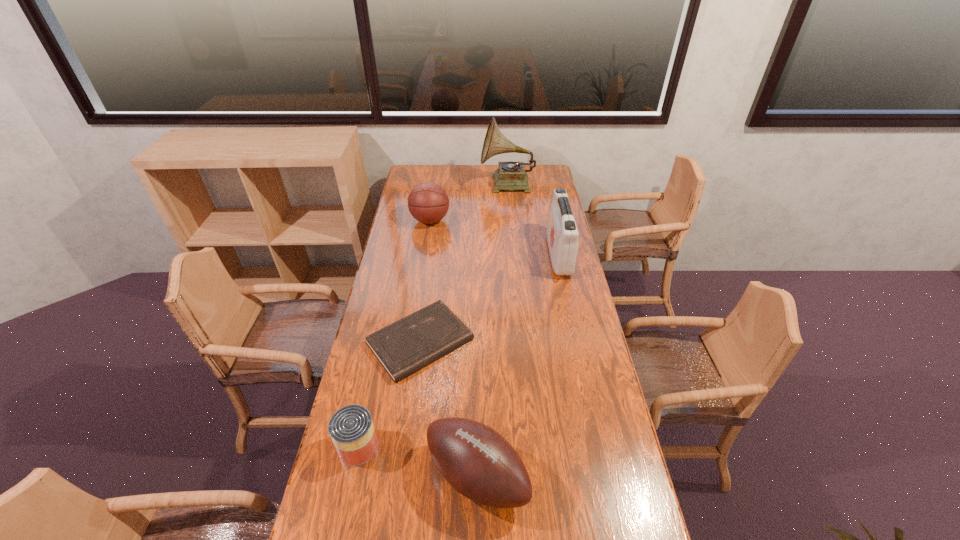
Identify the location of vacant region between the farthest object and the fifth nearest object. (468, 203).

The image size is (960, 540). What are the coordinates of `free spot between the can and the shortest object` in the screenshot? It's located at (389, 394).

I want to click on unoccupied position between the shortest object and the football (American), so click(x=448, y=409).

Locate an element on the screen. The image size is (960, 540). free spot between the football (American) and the farthest object is located at coordinates 492,331.

The height and width of the screenshot is (540, 960). What are the coordinates of `vacant region between the football (American) and the can` in the screenshot? It's located at (418, 462).

The height and width of the screenshot is (540, 960). I want to click on free point between the farthest object and the paperback book, so click(464, 264).

The image size is (960, 540). What are the coordinates of `free point between the basketball and the fourth farthest object` in the screenshot? It's located at (425, 281).

Find the location of a particular element. empty space that is in between the fifth shortest object and the can is located at coordinates (458, 350).

Select which object is the third closest to the can. Please provide its 2D coordinates. Your answer should be formatted as a tuple, i.e. [(x, y)], where the tuple contains the x and y coordinates of a point satisfying the conditions above.

[(562, 234)]

Where is `object that stands as the fifth closest to the second shortest object`? This screenshot has height=540, width=960. object that stands as the fifth closest to the second shortest object is located at coordinates [x=511, y=175].